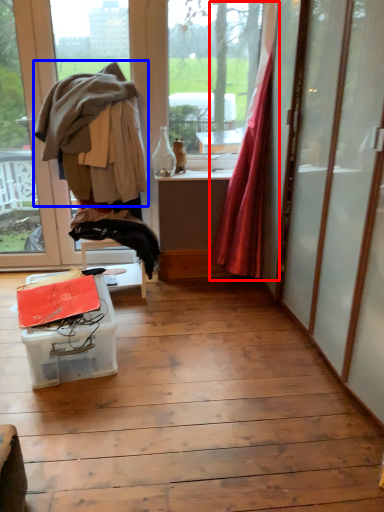
Question: Among these objects, which one is nearest to the camera, curtain (highlighted by a red box) or clothing (highlighted by a blue box)?

Choices:
 (A) curtain
 (B) clothing

Answer: (A)